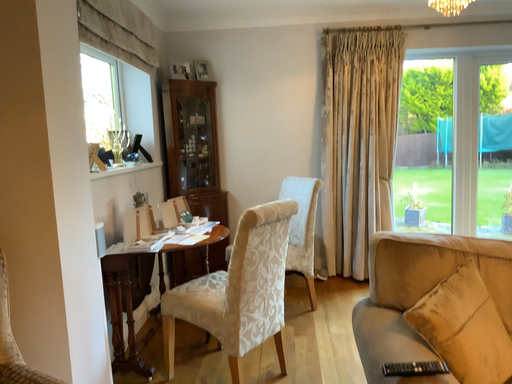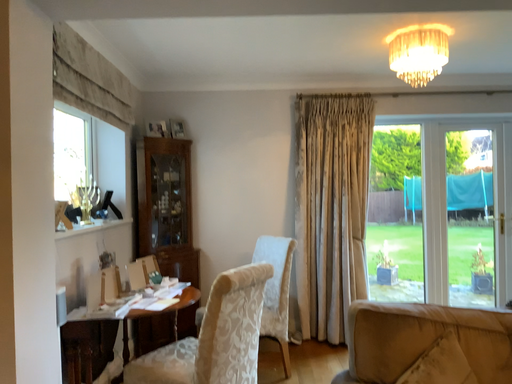
Question: How did the camera likely rotate when shooting the video?

Choices:
 (A) rotated upward
 (B) rotated downward

Answer: (A)